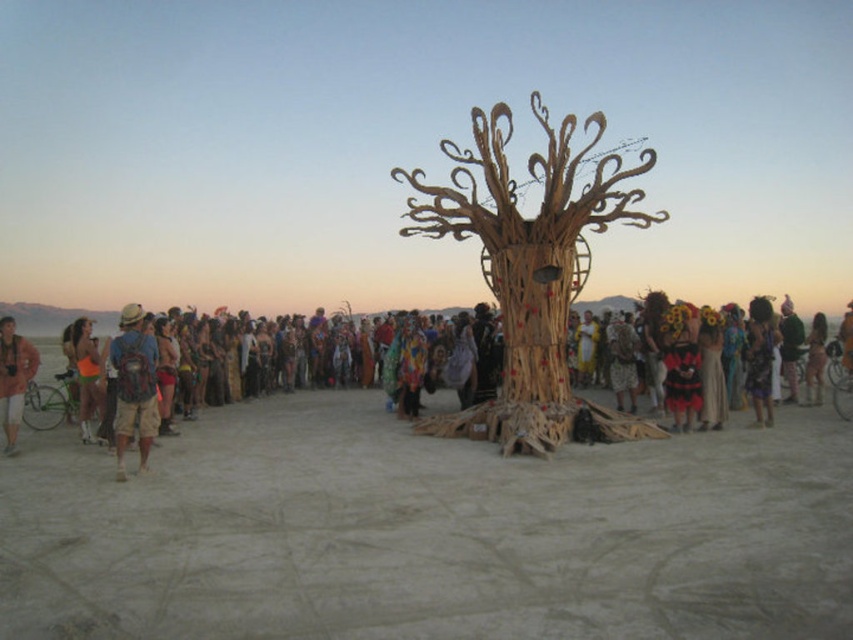
Does bamboo sculpture at center appear over matte brown backpack at left?

Yes, bamboo sculpture at center is above matte brown backpack at left.

This screenshot has width=853, height=640. I want to click on bamboo sculpture at center, so click(x=531, y=273).

Who is positioned more to the right, bamboo sculpture at center or wooden mask at center?

bamboo sculpture at center

Does point (486, 413) come closer to viewer compared to point (41, 314)?

Yes, it is.

Between point (579, 419) and point (370, 346), which one is positioned in front?

Point (579, 419) is more forward.

Image resolution: width=853 pixels, height=640 pixels. In order to click on bamboo sculpture at center in this screenshot , I will do `click(531, 273)`.

What do you see at coordinates (38, 316) in the screenshot? I see `wooden mask at center` at bounding box center [38, 316].

Which is in front, point (102, 321) or point (753, 384)?

Point (753, 384) is more forward.

Does point (27, 320) come in front of point (750, 397)?

No, it is not.

You are a GUI agent. You are given a task and a screenshot of the screen. Output one action in this format:
    pyautogui.click(x=<x>, y=<y>)
    Task: Click on the wooden mask at center
    This screenshot has height=640, width=853.
    Given the screenshot: What is the action you would take?
    pyautogui.click(x=38, y=316)